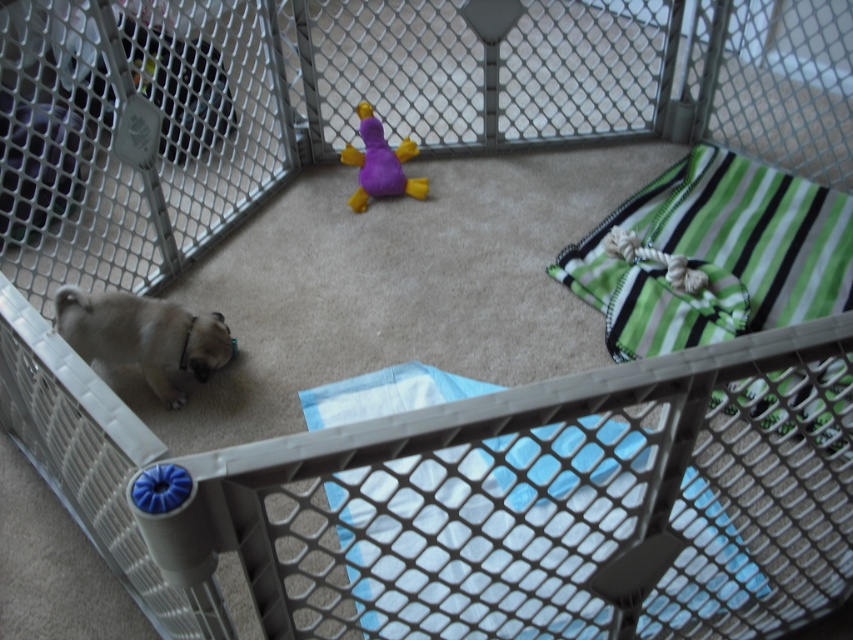
You are a caretaker standing outside the playpen and want to give the fuzzy beige dog at bottom left a treat. The treat is in your hand, and you need to reach over the playpen to drop it. The playpen is 3 feet tall. Can you safely drop the treat into the playpen without leaning over the edge?

The distance between the fuzzy beige dog at bottom left and the camera is 5.25 feet. Since the playpen is 3 feet tall, you can safely drop the treat into the playpen without leaning over the edge as the horizontal distance is sufficient to ensure the treat reaches the dog.

You are a new puppy owner who wants to ensure the fuzzy beige dog at bottom left has enough space to move around in the playpen. Considering the size of the purple plush duck at center, can you determine if the dog has enough space?

The fuzzy beige dog at bottom left is larger in width than the purple plush duck at center, so the dog should have sufficient space to move around the duck in the playpen.